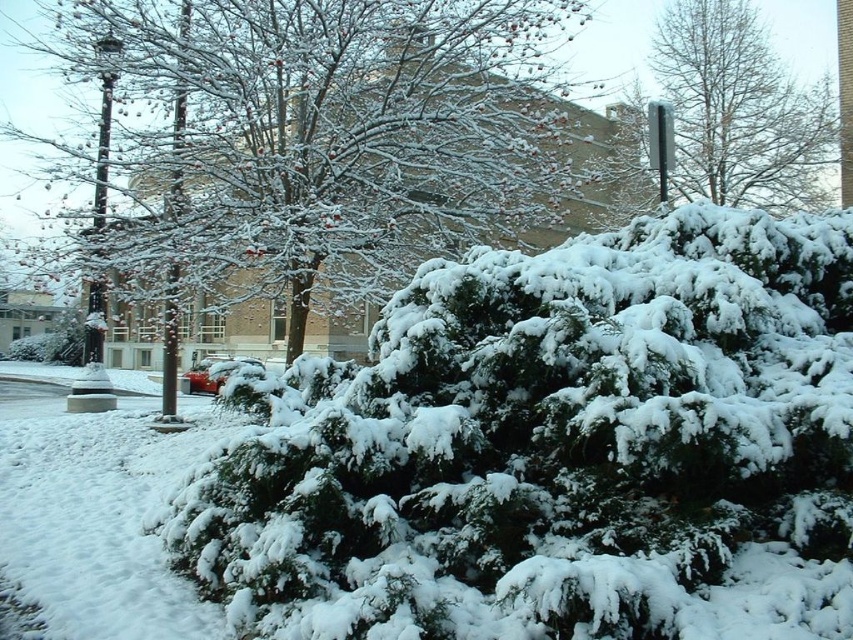
Question: Can you confirm if green textured bush at upper center is positioned to the left of snow-covered evergreen at center?

Choices:
 (A) no
 (B) yes

Answer: (A)

Question: Which of the following is the closest to the observer?

Choices:
 (A) (712, 36)
 (B) (28, 195)

Answer: (A)

Question: Among these objects, which one is farthest from the camera?

Choices:
 (A) snow-covered evergreen at center
 (B) green textured bush at upper center

Answer: (A)

Question: Considering the relative positions of green textured bush at upper center and snow-covered evergreen at center in the image provided, where is green textured bush at upper center located with respect to snow-covered evergreen at center?

Choices:
 (A) above
 (B) below

Answer: (A)

Question: Does green textured bush at upper center have a greater width compared to snow-covered evergreen at center?

Choices:
 (A) yes
 (B) no

Answer: (B)